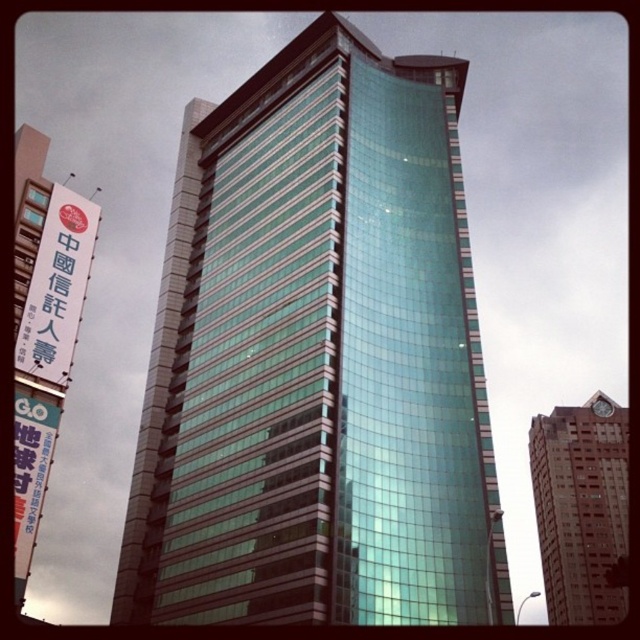
Does green glass building at center have a lesser width compared to white paper sign at left?

In fact, green glass building at center might be wider than white paper sign at left.

This screenshot has width=640, height=640. What do you see at coordinates (317, 358) in the screenshot?
I see `green glass building at center` at bounding box center [317, 358].

Who is more forward, (472, 376) or (49, 320)?

Positioned in front is point (49, 320).

Find the location of a particular element. green glass building at center is located at coordinates (317, 358).

Based on the photo, is brick textured building at upper right closer to camera compared to white paper sign at left?

No, brick textured building at upper right is further to the viewer.

Is brick textured building at upper right below white paper sign at left?

Yes.

Where is `brick textured building at upper right`? The height and width of the screenshot is (640, 640). brick textured building at upper right is located at coordinates (580, 508).

Locate an element on the screen. This screenshot has height=640, width=640. brick textured building at upper right is located at coordinates (580, 508).

What do you see at coordinates (317, 358) in the screenshot? I see `green glass building at center` at bounding box center [317, 358].

Measure the distance between green glass building at center and camera.

A distance of 43.76 meters exists between green glass building at center and camera.

In order to click on green glass building at center in this screenshot , I will do `click(317, 358)`.